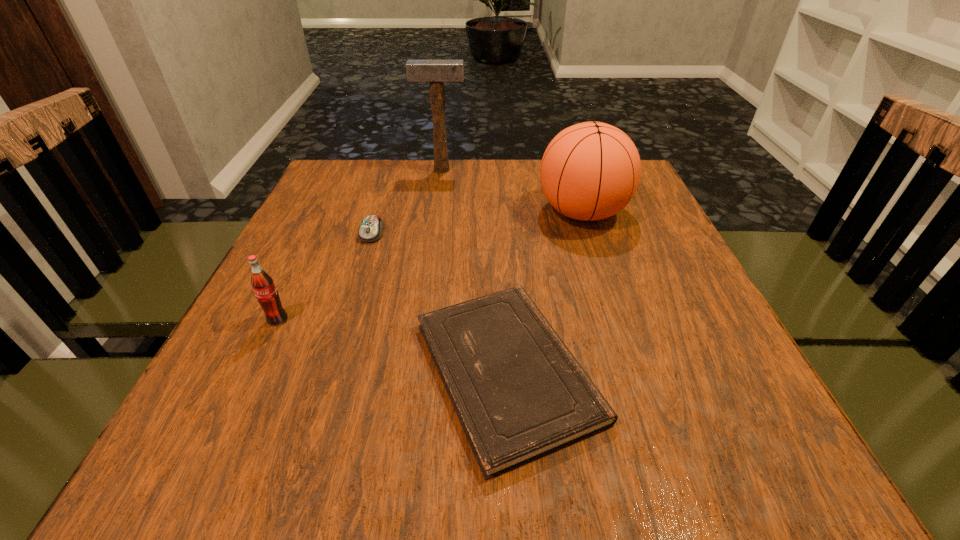
In the image, there is a desktop. Identify the location of vacant area at the near edge. The width and height of the screenshot is (960, 540). (404, 428).

The height and width of the screenshot is (540, 960). Identify the location of vacant area at the left edge. (286, 279).

In the image, there is a desktop. Where is `free space at the right edge`? free space at the right edge is located at coordinates (723, 404).

In order to click on vacant area at the far left corner in this screenshot , I will do `click(365, 185)`.

What are the coordinates of `vacant region at the near left corner of the desktop` in the screenshot? It's located at (233, 441).

Image resolution: width=960 pixels, height=540 pixels. What are the coordinates of `free region at the near right corner of the desktop` in the screenshot? It's located at (714, 482).

Locate an element on the screen. Image resolution: width=960 pixels, height=540 pixels. vacant area that lies between the paperback book and the fourth shortest object is located at coordinates (544, 292).

You are a GUI agent. You are given a task and a screenshot of the screen. Output one action in this format:
    pyautogui.click(x=<x>, y=<y>)
    Task: Click on the unoccupied area between the soda bottle and the paperback book
    This screenshot has height=540, width=960.
    Given the screenshot: What is the action you would take?
    pyautogui.click(x=393, y=346)

Identify the location of vacant region between the paperback book and the computer mouse. (440, 302).

Image resolution: width=960 pixels, height=540 pixels. I want to click on free space between the paperback book and the computer mouse, so click(x=440, y=302).